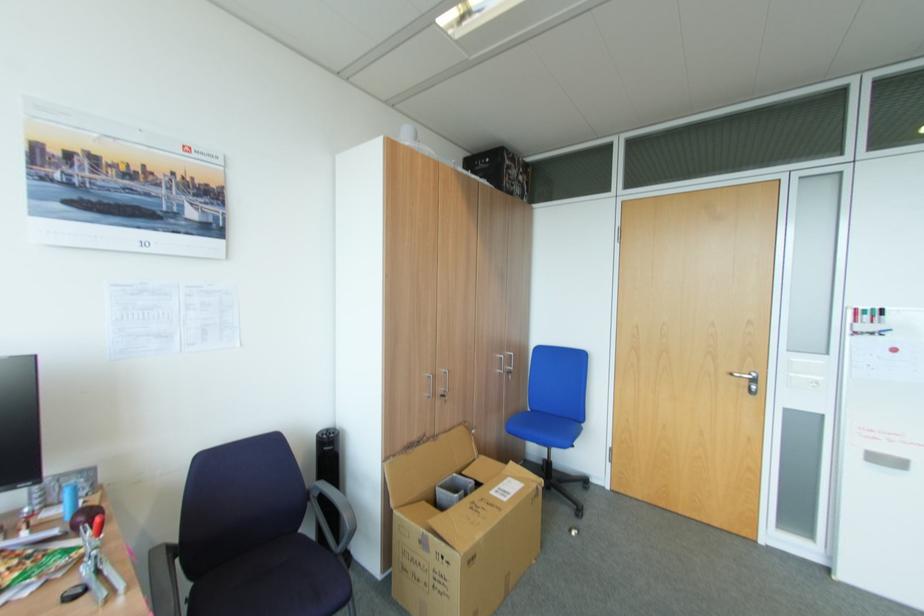
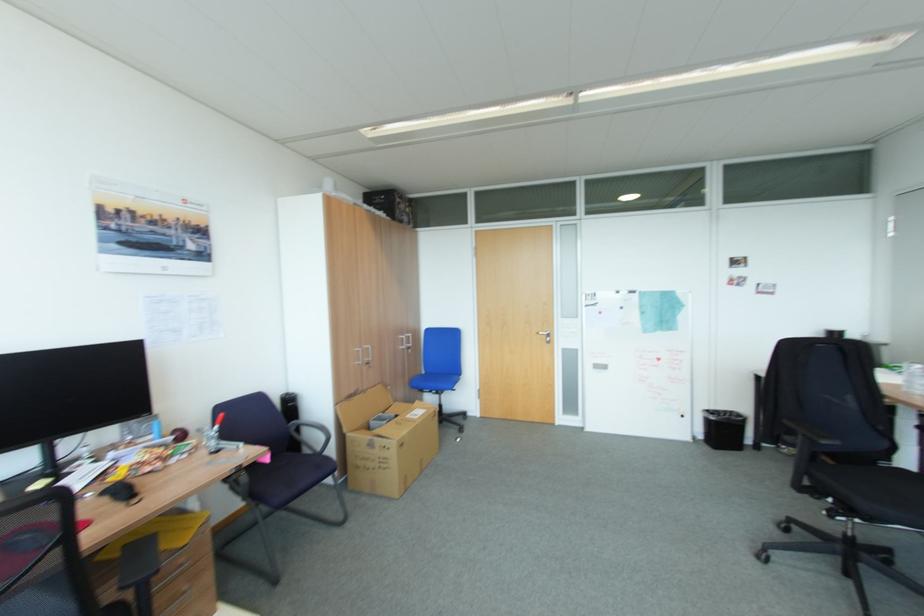
Find the pixel in the second image that matches (512,461) in the first image.

(419, 403)